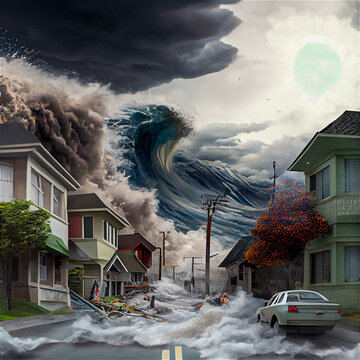
Identify the location of painting. The image size is (360, 360). (164, 179).